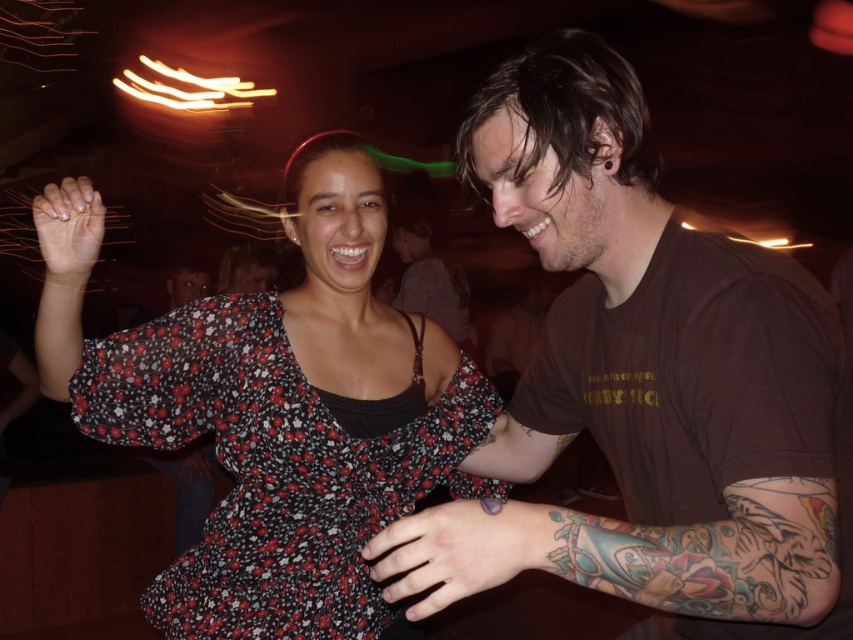
Is brown cotton t-shirt at right further to the viewer compared to floral-patterned fabric dress at center?

No, brown cotton t-shirt at right is closer to the viewer.

Between point (561, 237) and point (108, 396), which one is positioned in front?

Positioned in front is point (561, 237).

What do you see at coordinates (645, 381) in the screenshot? This screenshot has height=640, width=853. I see `brown cotton t-shirt at right` at bounding box center [645, 381].

You are a GUI agent. You are given a task and a screenshot of the screen. Output one action in this format:
    pyautogui.click(x=<x>, y=<y>)
    Task: Click on the brown cotton t-shirt at right
    
    Given the screenshot: What is the action you would take?
    pyautogui.click(x=645, y=381)